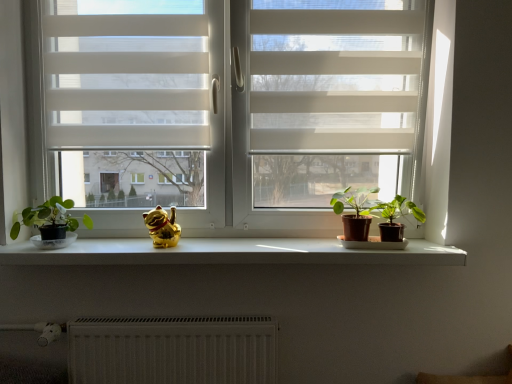
Question: Does white textured radiator at lower center come behind green matte plant at center, placed as the 2th houseplant when sorted from right to left?

Choices:
 (A) no
 (B) yes

Answer: (B)

Question: Is white textured radiator at lower center positioned before green matte plant at center, placed as the 2th houseplant when sorted from right to left?

Choices:
 (A) no
 (B) yes

Answer: (A)

Question: From a real-world perspective, is white textured radiator at lower center below green matte plant at center, which is counted as the second houseplant, starting from the left?

Choices:
 (A) yes
 (B) no

Answer: (A)

Question: Can you confirm if white textured radiator at lower center is bigger than green matte plant at center, placed as the 2th houseplant when sorted from right to left?

Choices:
 (A) no
 (B) yes

Answer: (B)

Question: Does white textured radiator at lower center turn towards green matte plant at center, placed as the 2th houseplant when sorted from right to left?

Choices:
 (A) no
 (B) yes

Answer: (A)

Question: Is white textured radiator at lower center at the left side of green matte plant at center, which is counted as the second houseplant, starting from the left?

Choices:
 (A) no
 (B) yes

Answer: (B)

Question: Does white smooth window sill at center have a greater height compared to white sheer blinds at upper left?

Choices:
 (A) yes
 (B) no

Answer: (B)

Question: From the image's perspective, is white smooth window sill at center on top of white sheer blinds at upper left?

Choices:
 (A) yes
 (B) no

Answer: (B)

Question: From the image's perspective, is white smooth window sill at center under white sheer blinds at upper left?

Choices:
 (A) yes
 (B) no

Answer: (A)

Question: Does white smooth window sill at center have a larger size compared to white sheer blinds at upper left?

Choices:
 (A) no
 (B) yes

Answer: (B)

Question: Is white smooth window sill at center at the right side of white sheer blinds at upper left?

Choices:
 (A) yes
 (B) no

Answer: (A)

Question: Considering the relative sizes of white smooth window sill at center and white sheer blinds at upper left in the image provided, is white smooth window sill at center smaller than white sheer blinds at upper left?

Choices:
 (A) yes
 (B) no

Answer: (B)

Question: From a real-world perspective, is gold shiny cat at center over green matte houseplant at right, the third houseplant when ordered from left to right?

Choices:
 (A) no
 (B) yes

Answer: (A)